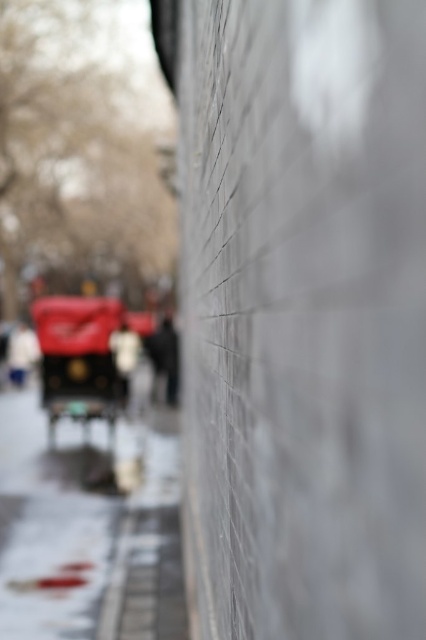
You are standing in front of the gray brick wall and want to place two markers at the specified coordinates. Which of the two points, point (69, 339) or point (160, 356), is closer to your current position?

Point (69, 339) is closer to the camera than point (160, 356), so it is closer to your current position.

You are a photographer trying to capture the shiny red car at left and the white cotton jacket at center in a single frame. Which object should you zoom in on to ensure both are visible without cropping?

The shiny red car at left is narrower than the white cotton jacket at center, so you should zoom in on the white cotton jacket at center to include both objects in the frame.

You are standing in the middle of the scene. There is a point at coordinate (81, 356). What object is located at that point?

The shiny red car at left is located at point (81, 356).